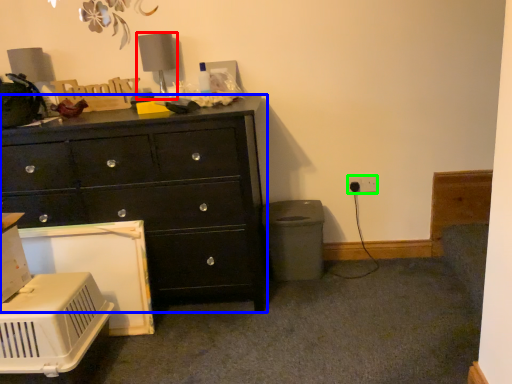
Question: Considering the real-world distances, which object is farthest from table lamp (highlighted by a red box)? chest of drawers (highlighted by a blue box) or electric outlet (highlighted by a green box)?

Choices:
 (A) chest of drawers
 (B) electric outlet

Answer: (B)